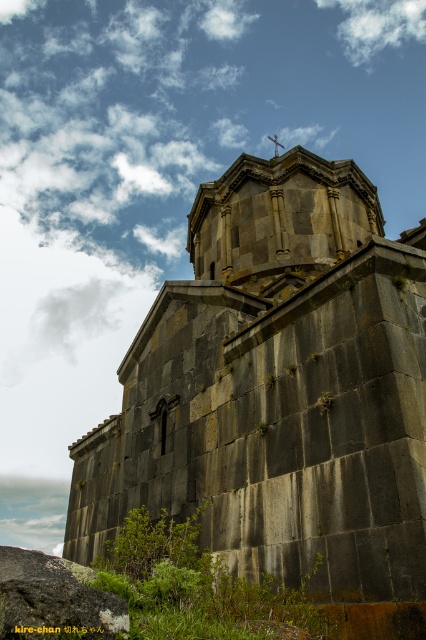
Question: Can you confirm if dark gray stone church at center is wider than metallic cross at upper center?

Choices:
 (A) no
 (B) yes

Answer: (B)

Question: Considering the relative positions of dark gray stone tower at upper center and metallic cross at upper center in the image provided, where is dark gray stone tower at upper center located with respect to metallic cross at upper center?

Choices:
 (A) below
 (B) above

Answer: (A)

Question: Can you confirm if dark gray stone church at center is bigger than dark gray stone tower at upper center?

Choices:
 (A) no
 (B) yes

Answer: (B)

Question: Estimate the real-world distances between objects in this image. Which object is farther from the gray rough rock at lower left?

Choices:
 (A) dark gray stone tower at upper center
 (B) dark gray stone church at center
 (C) metallic cross at upper center
 (D) white fluffy cloud at upper center

Answer: (D)

Question: Among these objects, which one is farthest from the camera?

Choices:
 (A) metallic cross at upper center
 (B) white fluffy cloud at upper center
 (C) gray rough rock at lower left
 (D) dark gray stone church at center

Answer: (B)

Question: Among these objects, which one is farthest from the camera?

Choices:
 (A) dark gray stone church at center
 (B) metallic cross at upper center
 (C) dark gray stone tower at upper center
 (D) white fluffy cloud at upper center

Answer: (D)